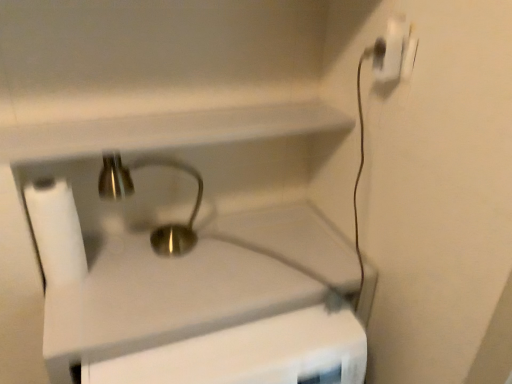
Locate an element on the screen. This screenshot has width=512, height=384. vacant area that lies to the right of white matte toilet paper at left is located at coordinates (141, 279).